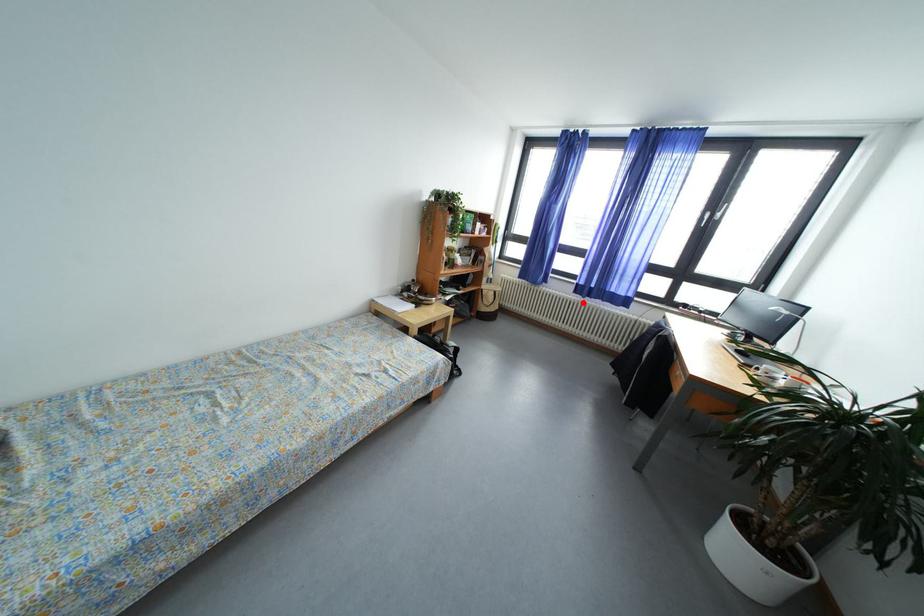
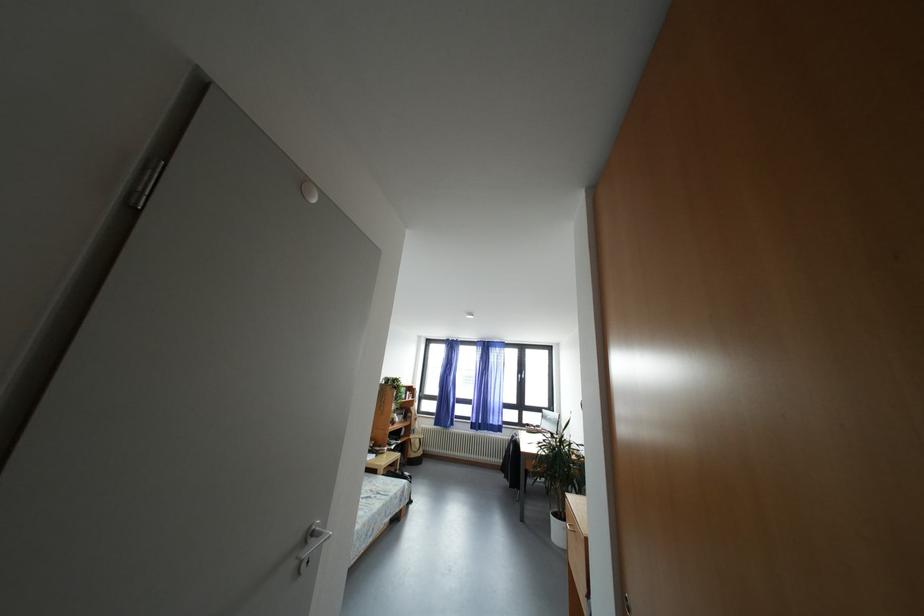
Find the pixel in the second image that matches the highlighted location in the first image.

(480, 437)